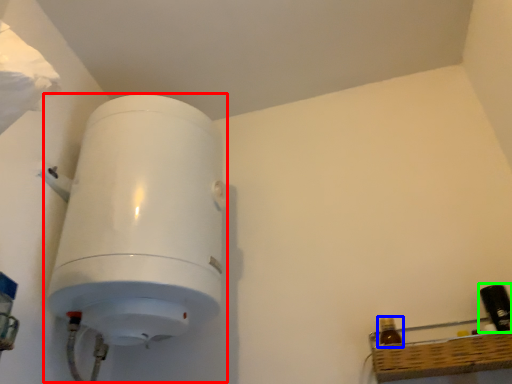
Question: Which object is the closest to the appliance (highlighted by a red box)? Choose among these: bottle (highlighted by a blue box) or bottle (highlighted by a green box).

Choices:
 (A) bottle
 (B) bottle

Answer: (A)